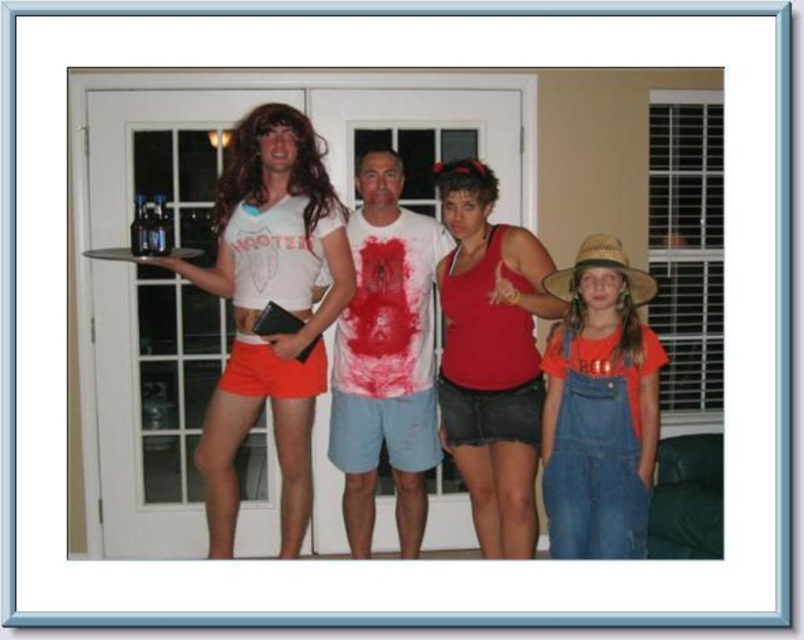
You are standing in a room and want to place a small potted plant at a point that is exactly 2.85 meters away from you. The point is labeled as point (292,340). Can you confirm if this point is at the correct distance?

Yes, the point (292,340) is exactly 2.85 meters away from the viewer, so placing the potted plant there would be correct.

You are standing at the point marked as point (298, 497) in the image. The glass door is directly in front of you. Can you reach the door without moving your feet?

Yes, because the distance between you and the glass door is 3.05 meters, which is sufficient to reach it without moving your feet.